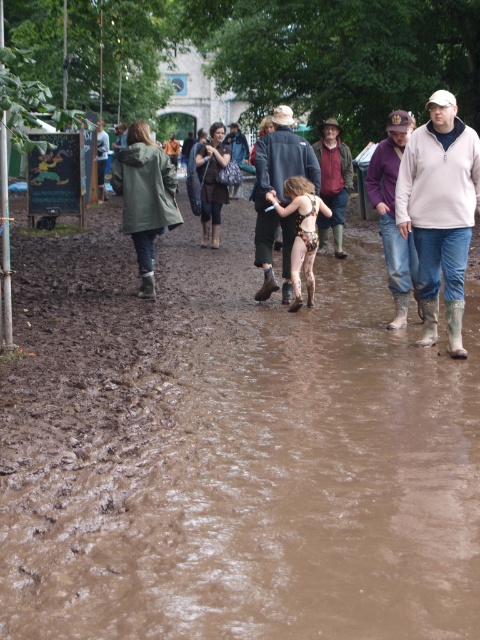
Question: Is brown muddy path at center thinner than metallic gold bikini at center?

Choices:
 (A) yes
 (B) no

Answer: (B)

Question: Which point is farther to the camera?

Choices:
 (A) (300, 253)
 (B) (391, 196)
 (C) (340, 250)

Answer: (C)

Question: Which object appears farthest from the camera in this image?

Choices:
 (A) purple fleece jacket at upper right
 (B) metallic gold bikini at center
 (C) light beige sweater at center

Answer: (B)

Question: Which object appears farthest from the camera in this image?

Choices:
 (A) matte black jacket at center
 (B) brown leather jacket at center
 (C) brown muddy path at center
 (D) light beige sweater at center

Answer: (A)

Question: Does green matte coat at center appear on the left side of brown leather jacket at center?

Choices:
 (A) no
 (B) yes

Answer: (B)

Question: Does brown leather jacket at center appear under matte black jacket at center?

Choices:
 (A) no
 (B) yes

Answer: (B)